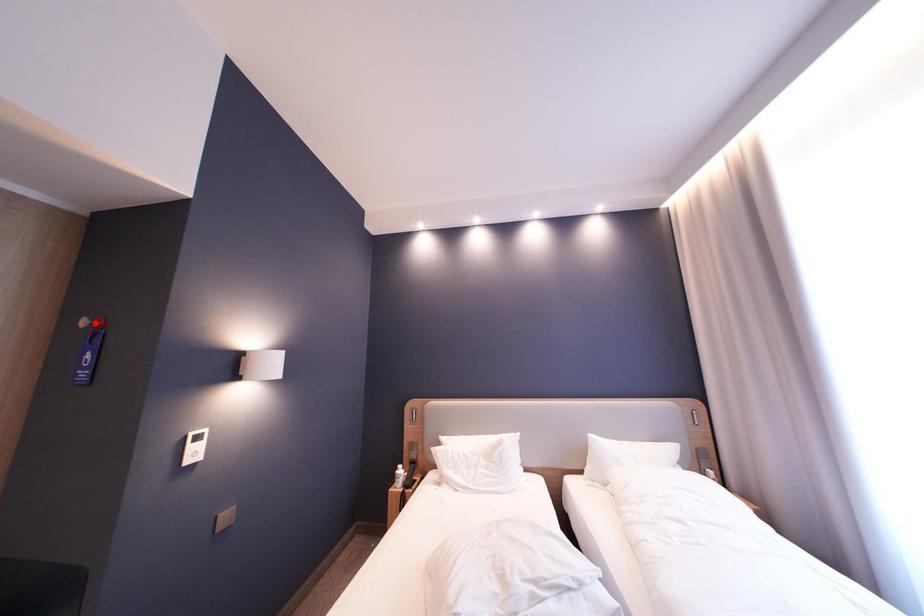
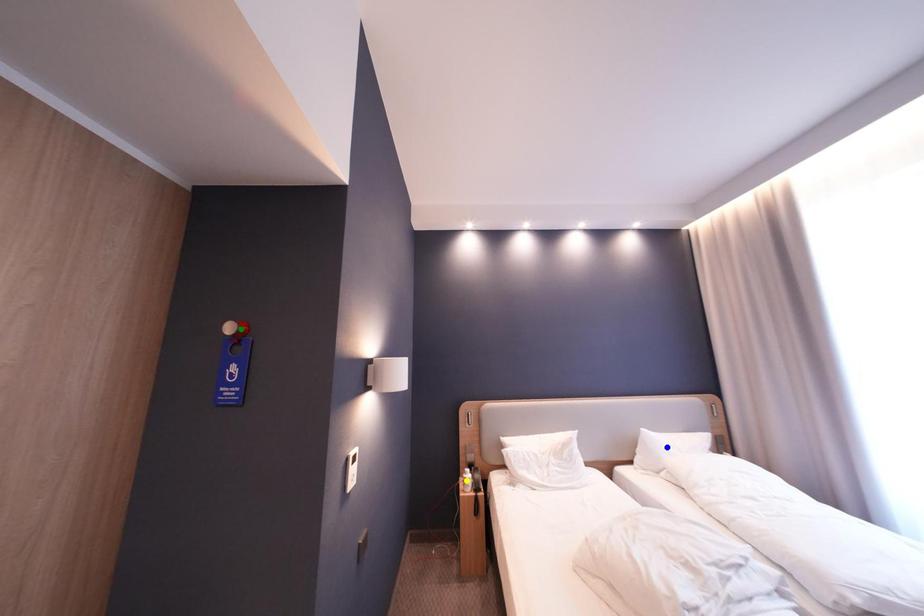
Question: I am providing you with two images of the same scene from different viewpoints. A red point is marked on the first image. You are given multiple points on the second image. Which point in image 2 is actually the same real-world point as the red point in image 1?

Choices:
 (A) blue point
 (B) green point
 (C) yellow point

Answer: (B)